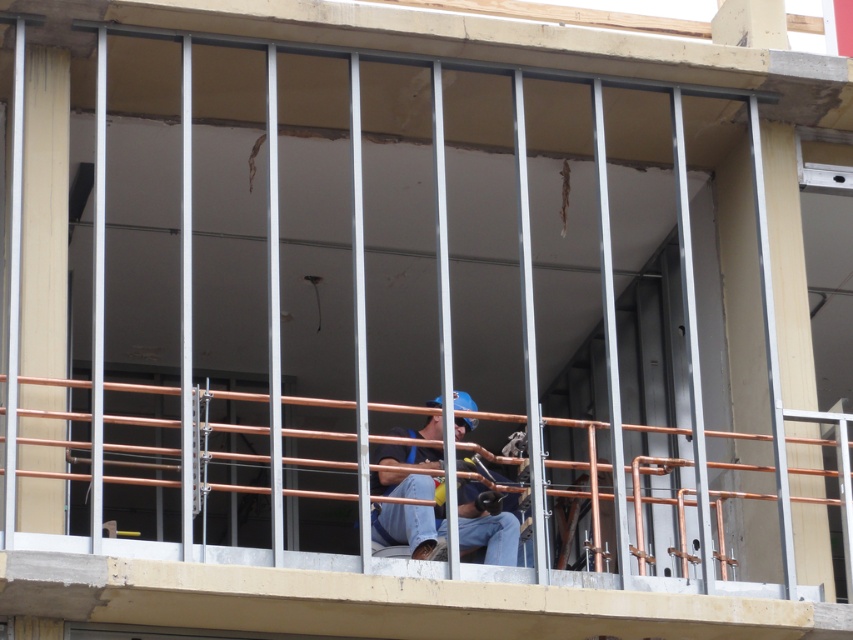
Based on the photo, you are a construction inspector who needs to check a specific point on the copper pipe railing at center. The point is located at coordinates point (381, 595). Based on the scene description, is this point on the railing or somewhere else?

The point (381, 595) is on the copper pipe railing at center, so it is on the railing.

You are a drone operator trying to capture aerial footage of the construction site. You need to fly your drone between the two points labeled point (248, 548) and point (457, 538). Considering their positions relative to the camera, which point should the drone pass closer to first?

The drone should first pass closer to point (248, 548) because it is closer to the camera than point (457, 538).